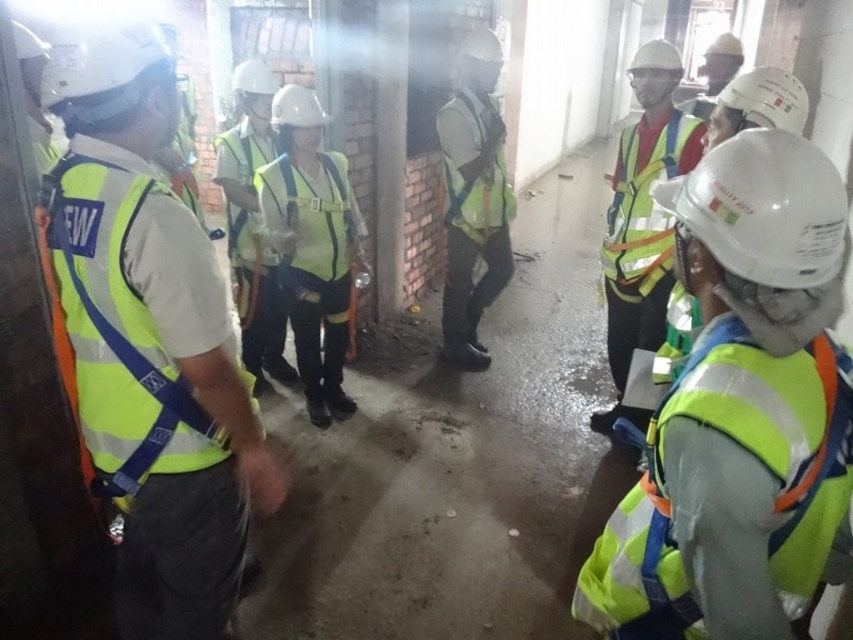
You are a safety inspector at the construction site shown in the image. You need to locate the neon yellow reflective vest at left for an inspection. According to the coordinates provided, where exactly should you look to find it?

The neon yellow reflective vest at left is located at point (152, 348).

You are a safety inspector standing at the entrance of a construction site. You notice a neon yellow reflective vest at left that you need to retrieve. If you walk forward 3 feet, will you be able to reach it?

The neon yellow reflective vest at left is 4.20 feet away from you. After walking forward 3 feet, you will still be 1.20 feet away from it, so you need to move closer.